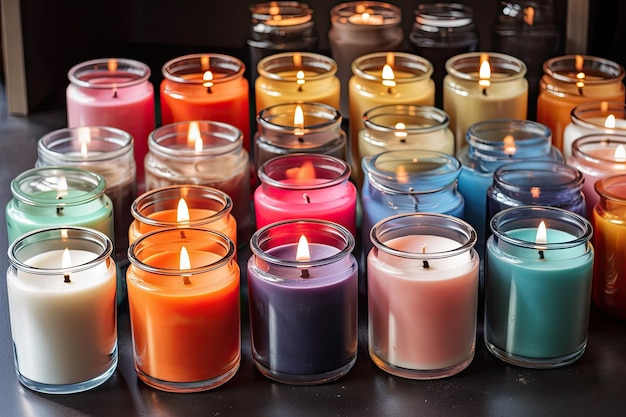
You are a GUI agent. You are given a task and a screenshot of the screen. Output one action in this format:
    pyautogui.click(x=<x>, y=<y>)
    Task: Click on the orange candles
    
    Given the screenshot: What is the action you would take?
    pyautogui.click(x=198, y=340), pyautogui.click(x=162, y=216), pyautogui.click(x=603, y=76), pyautogui.click(x=192, y=77), pyautogui.click(x=612, y=220)